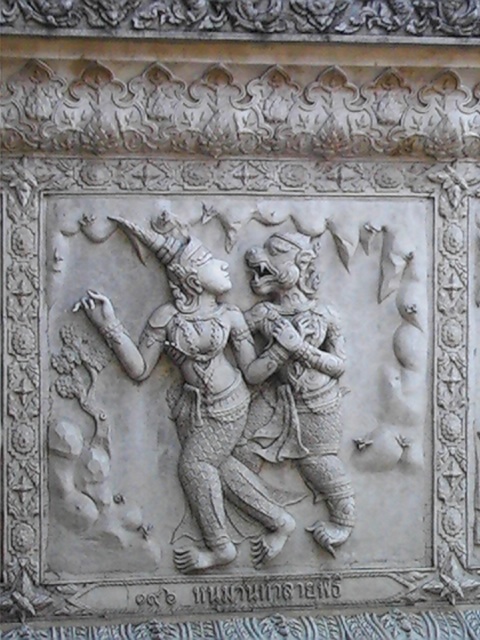
You are an art conservator examining the stone relief sculpture. You need to clean the white stone deity at center and the white stone demon at center. Which one should you start with if you want to work on the figure that is positioned closer to the viewer?

The white stone deity at center is closer to the viewer than the white stone demon at center, so you should start by cleaning the white stone deity at center first.

Based on the scene description, which object is taller between the white stone deity at center and the white stone demon at center?

The white stone deity at center is much taller than the white stone demon at center according to the description.

Based on the scene description, which object is wider between the white stone deity at center and the white stone demon at center?

The white stone deity at center is wider than the white stone demon at center according to the description.